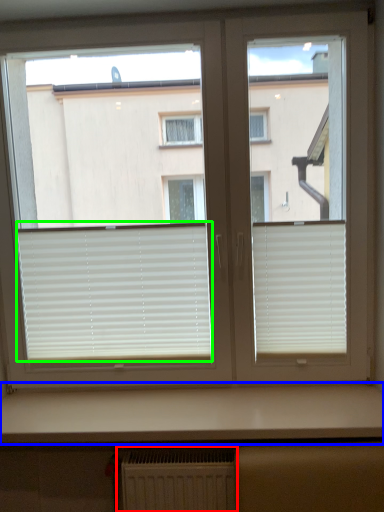
Question: Which object is positioned farthest from radiator (highlighted by a red box)? Select from counter top (highlighted by a blue box) and window blind (highlighted by a green box).

Choices:
 (A) counter top
 (B) window blind

Answer: (B)